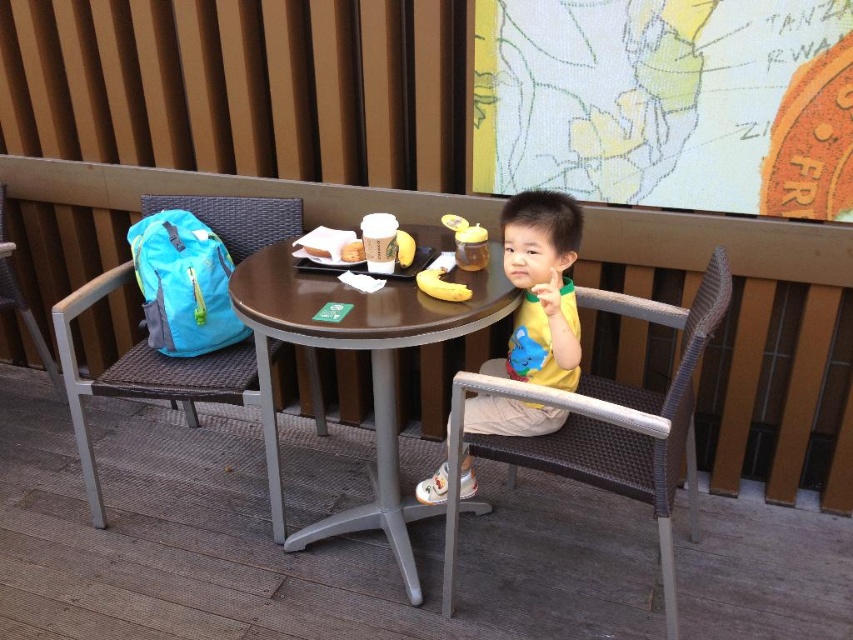
You are a parent trying to pack snacks for your child. The blue fabric backpack at left has a height of 30 cm. The yellow matte banana at center is 15 cm tall. Can the banana fit vertically inside the backpack?

The blue fabric backpack at left is taller than the yellow matte banana at center, so yes, the banana can fit vertically inside the backpack since its height is 15 cm, which is less than the backpacks 30 cm height.

You are a photographer setting up a shot of the brown woven chair at center and the yellow matte shirt at center. Which object should you focus on first if you want to capture both in the frame without adjusting your camera angle?

The brown woven chair at center is wider than the yellow matte shirt at center, so you should focus on the brown woven chair at center first to ensure it fits within the frame.

You are a customer at the outdoor seating area and want to place your phone on the table. The blue fabric backpack at left and the yellow matte banana at center are already on the table. Where should you place your phone so it doesn not fall off the table?

Place the phone near the edge opposite to the blue fabric backpack at left and yellow matte banana at center to ensure stability.